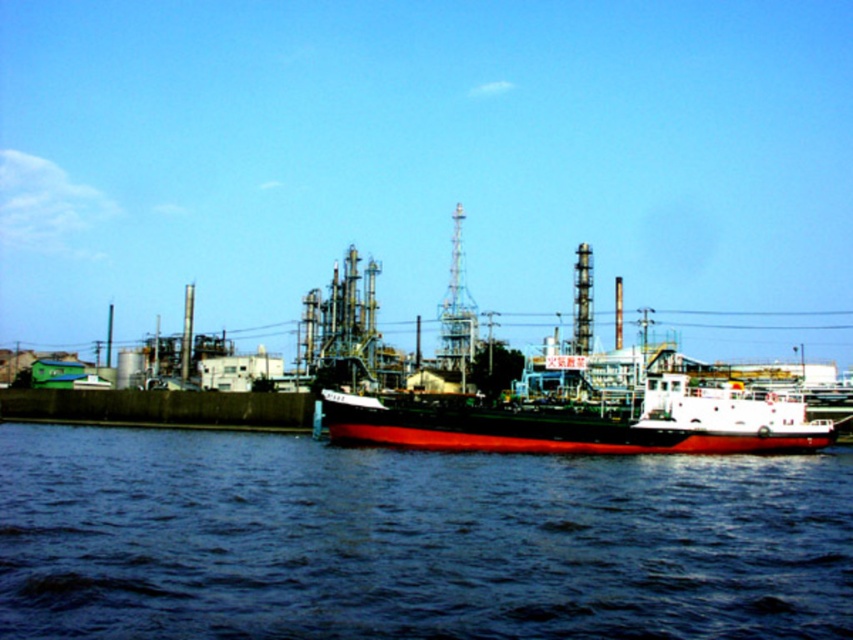
Between point (718, 484) and point (680, 412), which one is positioned in front?

Point (718, 484) is in front.

Locate an element on the screen. dark blue water at center is located at coordinates (410, 540).

I want to click on dark blue water at center, so click(410, 540).